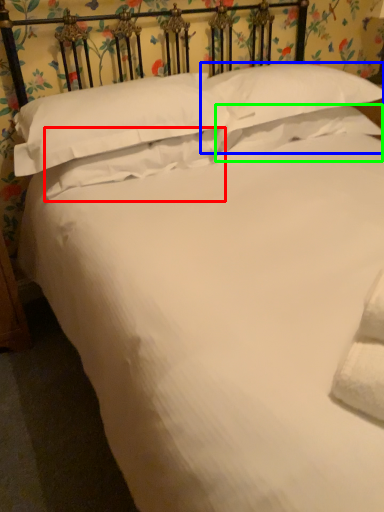
Question: Which object is the farthest from pillow (highlighted by a red box)? Choose among these: pillow (highlighted by a blue box) or pillow (highlighted by a green box).

Choices:
 (A) pillow
 (B) pillow

Answer: (A)